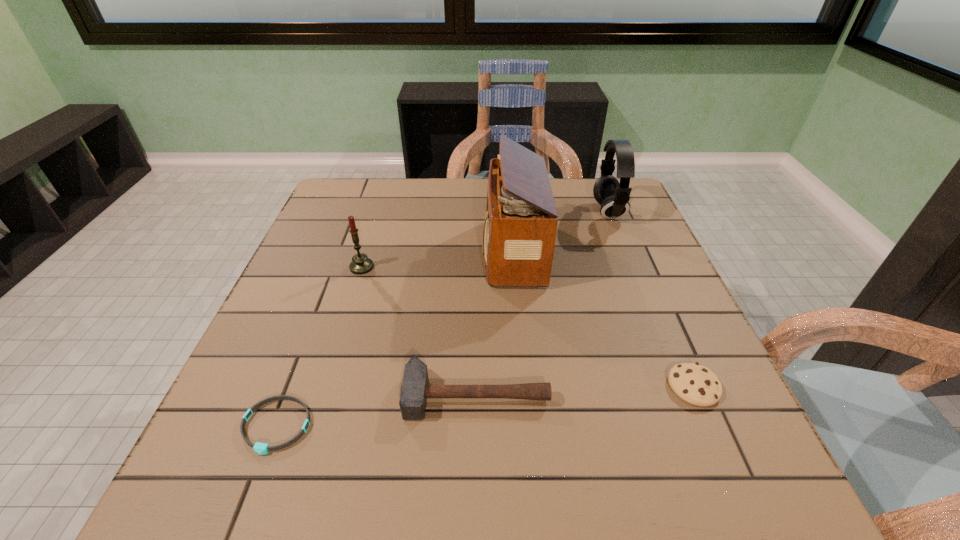
The image size is (960, 540). What are the coordinates of `earphone that is positioned at the right edge` in the screenshot? It's located at (614, 197).

This screenshot has height=540, width=960. I want to click on cookie situated at the right edge, so [695, 384].

Where is `object positioned at the near left corner`? This screenshot has height=540, width=960. object positioned at the near left corner is located at coordinates (260, 448).

What are the coordinates of `object that is at the far right corner` in the screenshot? It's located at (614, 197).

I want to click on free region at the far edge of the desktop, so click(x=568, y=215).

In the image, there is a desktop. Where is `vacant area at the near edge`? This screenshot has height=540, width=960. vacant area at the near edge is located at coordinates (485, 462).

Identify the location of vacant space at the left edge of the desktop. (294, 315).

Identify the location of vacant space at the right edge of the desktop. The width and height of the screenshot is (960, 540). (716, 361).

Where is `vacant region at the far left corner of the desktop`? This screenshot has width=960, height=540. vacant region at the far left corner of the desktop is located at coordinates (359, 219).

You are a GUI agent. You are given a task and a screenshot of the screen. Output one action in this format:
    pyautogui.click(x=<x>, y=<y>)
    Task: Click on the vacant space at the near left corner
    The height and width of the screenshot is (540, 960).
    Given the screenshot: What is the action you would take?
    pyautogui.click(x=197, y=489)